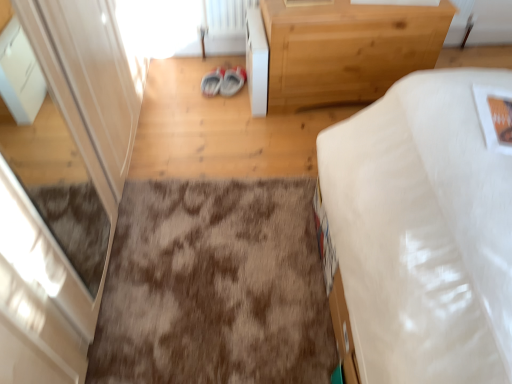
Question: Is white glossy screen door at left wider or thinner than white glossy cabinet at upper center?

Choices:
 (A) wide
 (B) thin

Answer: (B)

Question: From the image's perspective, is white glossy screen door at left positioned above or below white glossy cabinet at upper center?

Choices:
 (A) below
 (B) above

Answer: (A)

Question: Estimate the real-world distances between objects in this image. Which object is closer to the matte gray sneakers at center?

Choices:
 (A) white glossy screen door at left
 (B) white glossy cabinet at upper center
 (C) brown shaggy rug at center
 (D) light wood/texture chest of drawers at upper right

Answer: (B)

Question: Estimate the real-world distances between objects in this image. Which object is farther from the white glossy screen door at left?

Choices:
 (A) brown shaggy rug at center
 (B) light wood/texture chest of drawers at upper right
 (C) matte gray sneakers at center
 (D) white glossy cabinet at upper center

Answer: (B)